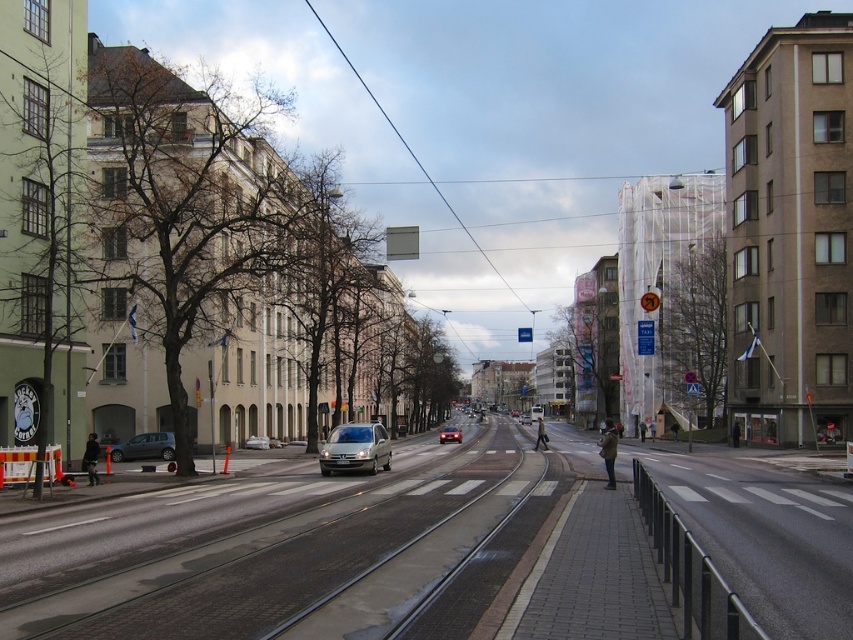
You are standing at the center of the image. Which direction should you walk to reach the matte gray car at left?

You should walk to the left to reach the matte gray car at left since it is located at the left side of the image.

You are standing on the urban street scene and want to determine which of the two points, point (456, 429) or point (527, 420), is nearer to you. Based on the scene description, which point is closer?

Point (456, 429) is closer to the viewer than point (527, 420).

You are a pedestrian standing on the sidewalk and want to cross the street. You see a satin silver van at center and a silver metallic sedan at center. Which vehicle should you look out for first as you step into the crosswalk?

The satin silver van at center is above the silver metallic sedan at center, so you should look out for the satin silver van at center first since it is closer to your eye level when crossing.